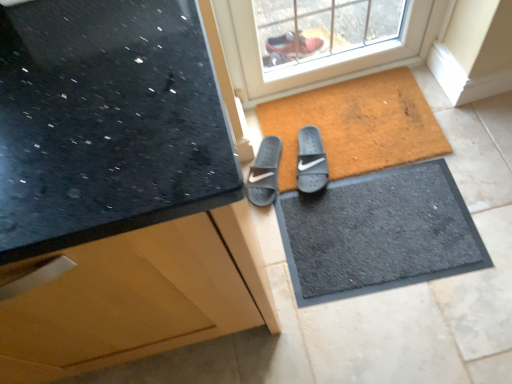
Identify the location of free space to the left of gray rubber slide at center, which ranks as the 2th footwear in left-to-right order. click(275, 164).